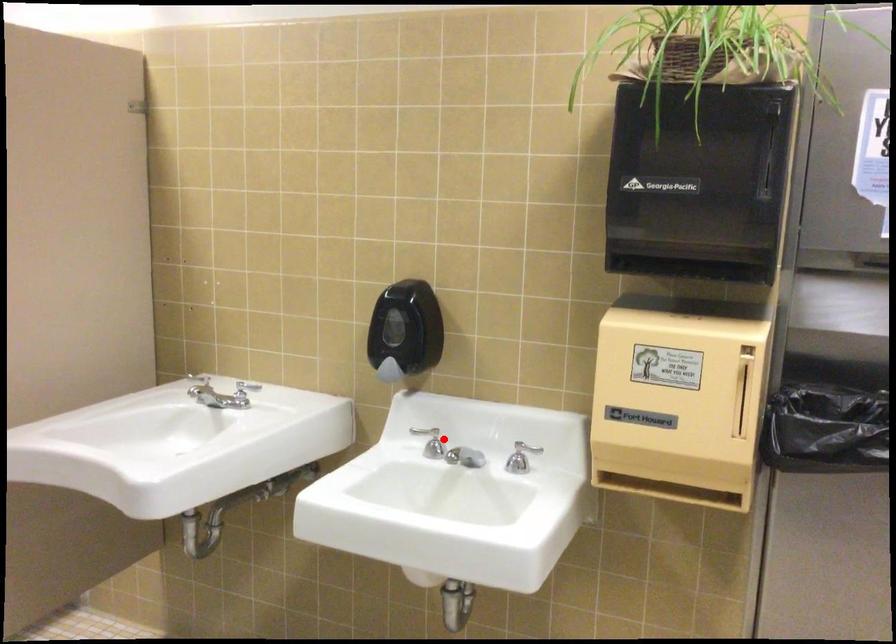
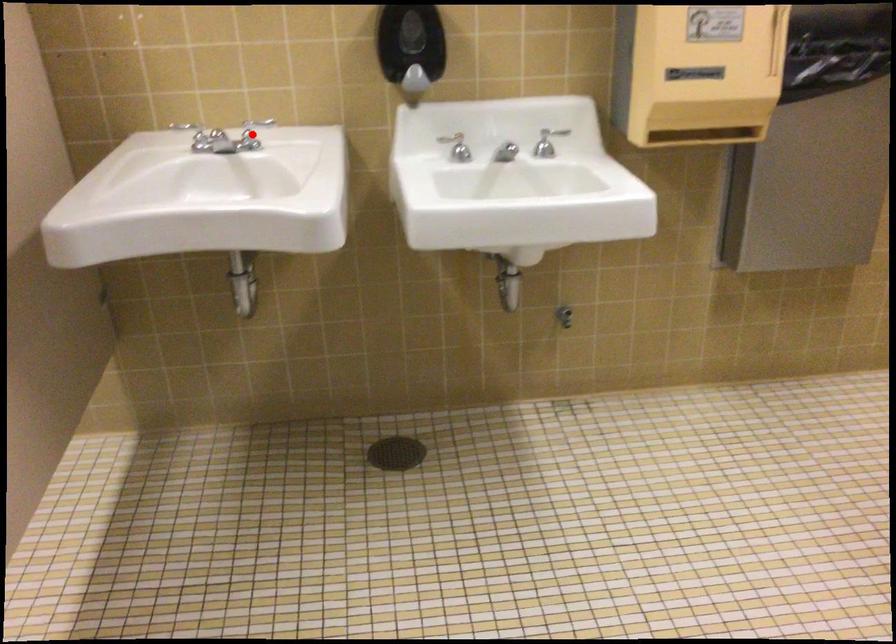
I am providing you with two images of the same scene from different viewpoints. A red point is marked on the first image and another point is marked on the second image. Is the red point in image1 aligned with the point shown in image2?

No